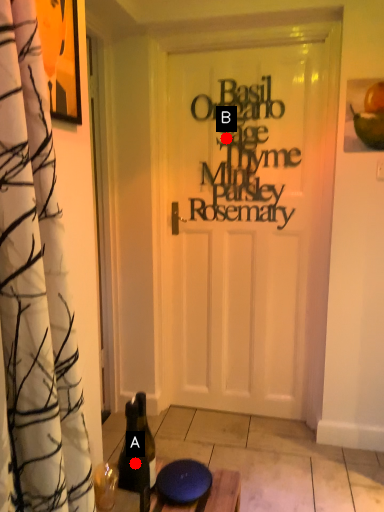
Question: Two points are circled on the image, labeled by A and B beside each circle. Which point appears closest to the camera in this image?

Choices:
 (A) A is closer
 (B) B is closer

Answer: (A)